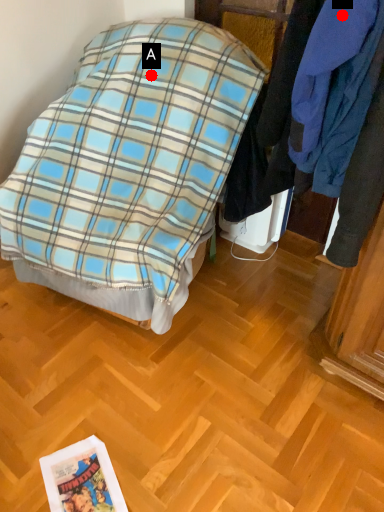
Question: Two points are circled on the image, labeled by A and B beside each circle. Which point is closer to the camera?

Choices:
 (A) A is closer
 (B) B is closer

Answer: (B)